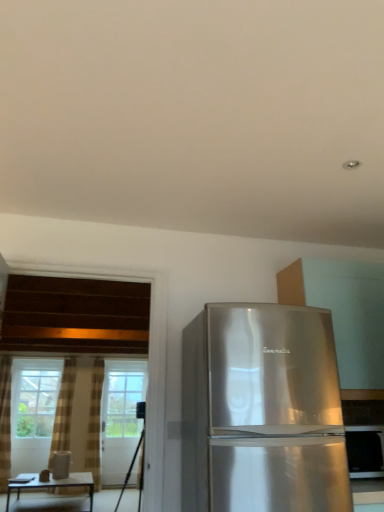
Question: Is satin silver refrigerator at right located outside brown textured curtain at left, marked as the 2th curtain in a right-to-left arrangement?

Choices:
 (A) yes
 (B) no

Answer: (A)

Question: From the image's perspective, is satin silver refrigerator at right under brown textured curtain at left, which is counted as the first curtain, starting from the left?

Choices:
 (A) no
 (B) yes

Answer: (A)

Question: Does satin silver refrigerator at right have a greater width compared to brown textured curtain at left, marked as the 2th curtain in a right-to-left arrangement?

Choices:
 (A) no
 (B) yes

Answer: (B)

Question: From a real-world perspective, is satin silver refrigerator at right positioned over brown textured curtain at left, marked as the 2th curtain in a right-to-left arrangement, based on gravity?

Choices:
 (A) no
 (B) yes

Answer: (A)

Question: Is satin silver refrigerator at right in contact with brown textured curtain at left, marked as the 2th curtain in a right-to-left arrangement?

Choices:
 (A) no
 (B) yes

Answer: (A)

Question: Does point 120,488 appear closer or farther from the camera than point 100,465?

Choices:
 (A) closer
 (B) farther

Answer: (B)

Question: Is black matte tripod at lower left inside or outside of clear glass screen door at center?

Choices:
 (A) outside
 (B) inside

Answer: (A)

Question: Relative to clear glass screen door at center, is black matte tripod at lower left in front or behind?

Choices:
 (A) behind
 (B) front

Answer: (B)

Question: Is black matte tripod at lower left to the left or to the right of clear glass screen door at center in the image?

Choices:
 (A) left
 (B) right

Answer: (B)

Question: In the image, is black matte tripod at lower left on the left side or the right side of satin silver refrigerator at right?

Choices:
 (A) right
 (B) left

Answer: (B)

Question: Does point (142, 435) appear closer or farther from the camera than point (377, 461)?

Choices:
 (A) farther
 (B) closer

Answer: (A)

Question: Is black matte tripod at lower left wider or thinner than satin silver refrigerator at right?

Choices:
 (A) thin
 (B) wide

Answer: (B)

Question: Is black matte tripod at lower left taller or shorter than satin silver refrigerator at right?

Choices:
 (A) short
 (B) tall

Answer: (B)

Question: Looking at their shapes, would you say satin silver refrigerator at right is wider or thinner than matte brown table at lower left?

Choices:
 (A) thin
 (B) wide

Answer: (A)

Question: Based on their sizes in the image, would you say satin silver refrigerator at right is bigger or smaller than matte brown table at lower left?

Choices:
 (A) small
 (B) big

Answer: (A)